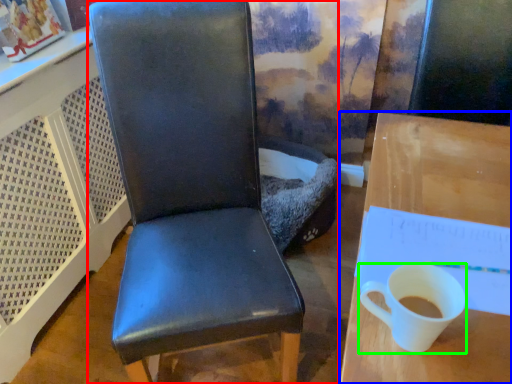
Question: Which is nearer to the chair (highlighted by a red box)? desk (highlighted by a blue box) or coffee cup (highlighted by a green box).

Choices:
 (A) desk
 (B) coffee cup

Answer: (A)